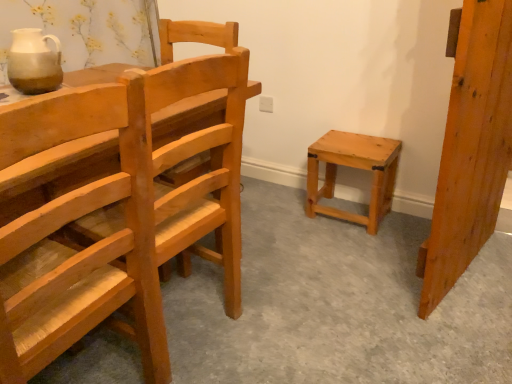
You are a GUI agent. You are given a task and a screenshot of the screen. Output one action in this format:
    pyautogui.click(x=<x>, y=<y>)
    Task: Click on the free space in front of natural wood door at right
    This screenshot has width=512, height=384.
    Given the screenshot: What is the action you would take?
    pyautogui.click(x=467, y=321)